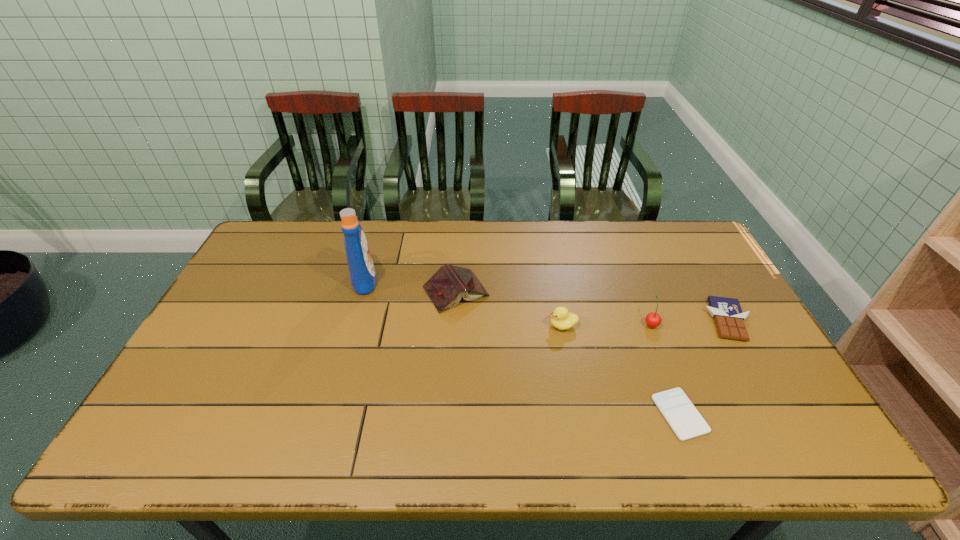
Identify the location of free location located on the label of the tallest object. (408, 280).

The width and height of the screenshot is (960, 540). I want to click on free space located 0.350m on the front of the cherry, so click(x=698, y=447).

Locate an element on the screen. This screenshot has width=960, height=540. free spot located on the beak of the third object from left to right is located at coordinates (448, 326).

Find the location of a particular element. The image size is (960, 540). free point located 0.280m on the beak of the third object from left to right is located at coordinates (452, 326).

What are the coordinates of `vacant space positioned on the beak of the third object from left to right` in the screenshot? It's located at (x=415, y=326).

Locate an element on the screen. The height and width of the screenshot is (540, 960). vacant area situated on the front of the book is located at coordinates (449, 395).

The image size is (960, 540). I want to click on free space located on the front of the chocolate bar, so click(x=791, y=432).

In order to click on vacant space located 0.070m on the right of the shortest object in this screenshot , I will do `click(732, 414)`.

Where is `object that is at the near edge`? object that is at the near edge is located at coordinates (682, 416).

Find the location of `object situated at the right edge`. object situated at the right edge is located at coordinates (727, 313).